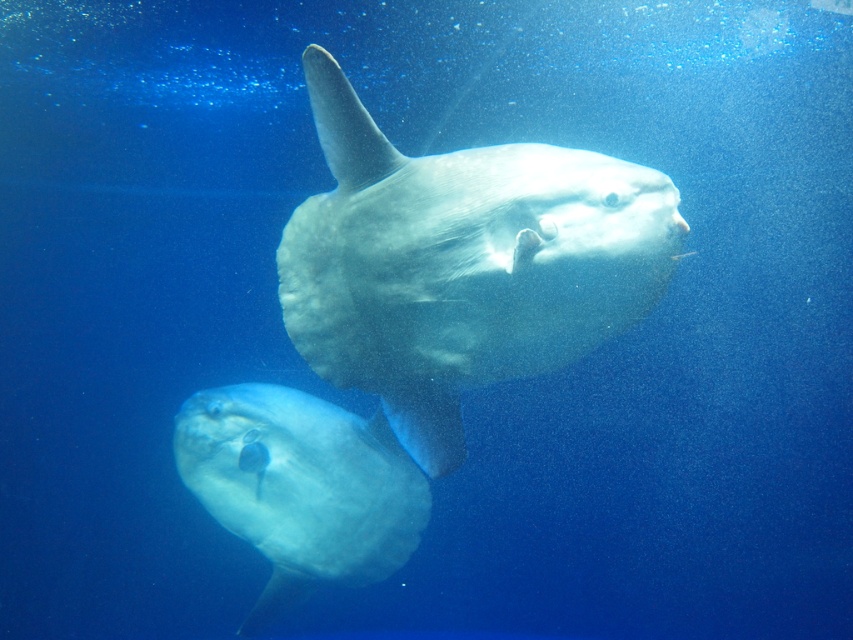
You are a marine biologist observing two fish in the ocean. You notice a translucent white fish at center and a translucent rubber fish at center. Which one is located above the other?

The translucent white fish at center is positioned over the translucent rubber fish at center.